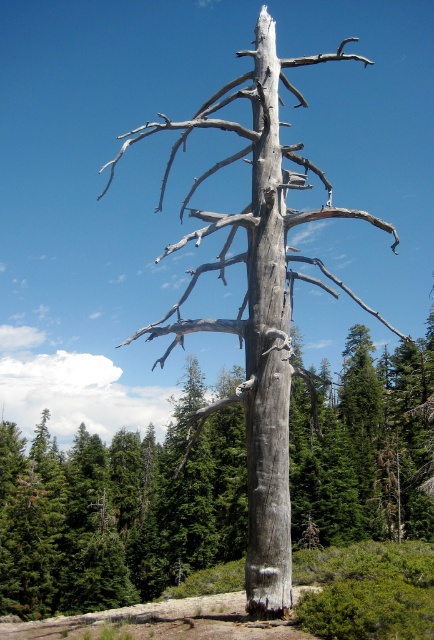
Question: Can you confirm if gray bark tree at center is positioned to the left of gray rough bark tree trunk at center?

Choices:
 (A) no
 (B) yes

Answer: (A)

Question: Based on their relative distances, which object is nearer to the gray textured trunk at center?

Choices:
 (A) gray bark tree at center
 (B) gray rough bark tree trunk at center

Answer: (A)

Question: Is gray textured trunk at center positioned before gray rough bark tree trunk at center?

Choices:
 (A) yes
 (B) no

Answer: (B)

Question: Estimate the real-world distances between objects in this image. Which object is closer to the gray bark tree at center?

Choices:
 (A) gray textured trunk at center
 (B) gray rough bark tree trunk at center

Answer: (A)

Question: Can you confirm if gray textured trunk at center is smaller than gray bark tree at center?

Choices:
 (A) no
 (B) yes

Answer: (B)

Question: Among these objects, which one is nearest to the camera?

Choices:
 (A) gray rough bark tree trunk at center
 (B) gray textured trunk at center
 (C) gray bark tree at center

Answer: (A)